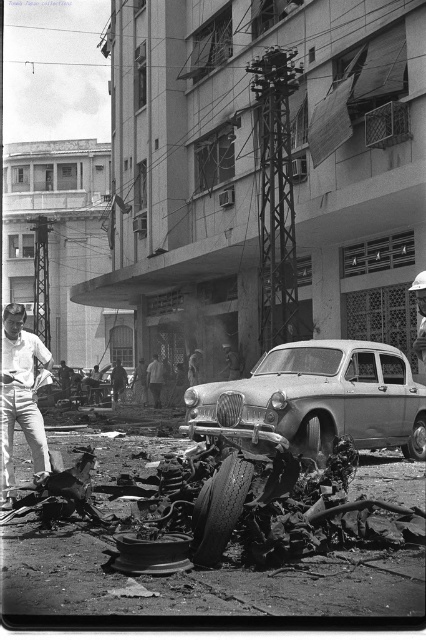
You are a rescue worker trying to reach the white cotton shirt at left located near the rubble. The rusty metal car at center is blocking your path. Can you safely walk around the car to reach the shirt?

The rusty metal car at center is 11.73 feet away from the white cotton shirt at left. Since the car is blocking the direct path, you can safely walk around it to reach the shirt as the distance allows enough space for maneuvering around the car.

You are a photographer analyzing the scene. You notice the rusty metal car at center and the white cotton shirt at left. Which object takes up more space in the photo?

The rusty metal car at center is larger in size than the white cotton shirt at left, so it takes up more space in the photo.